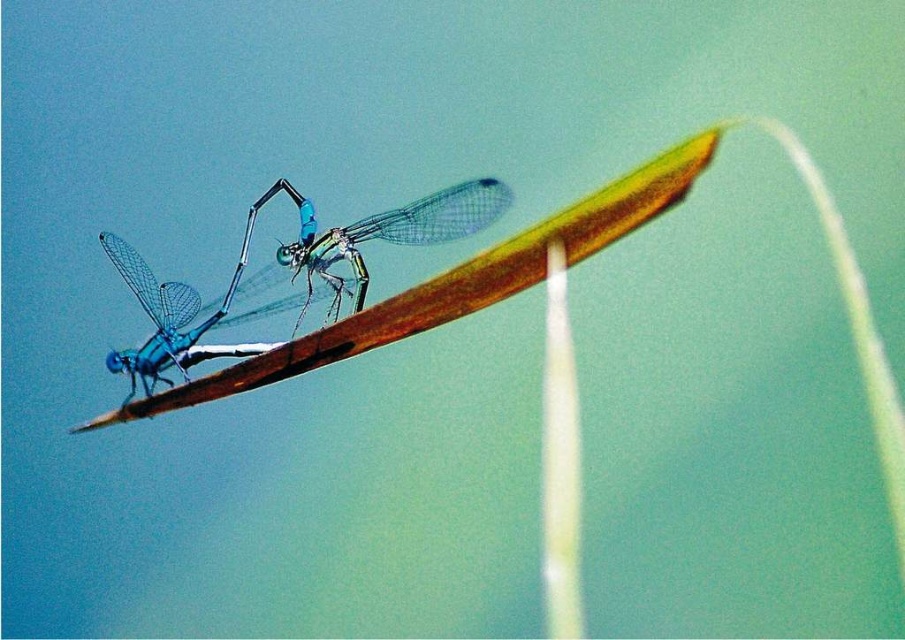
Question: Which object appears closest to the camera in this image?

Choices:
 (A) translucent glass dragonfly at center
 (B) translucent blue dragonfly at center

Answer: (B)

Question: Is translucent glass dragonfly at center closer to the viewer compared to translucent blue dragonfly at center?

Choices:
 (A) no
 (B) yes

Answer: (A)

Question: Which point is closer to the camera taking this photo?

Choices:
 (A) (334, 310)
 (B) (243, 342)

Answer: (B)

Question: Can you confirm if translucent glass dragonfly at center is positioned to the left of translucent blue dragonfly at center?

Choices:
 (A) yes
 (B) no

Answer: (B)

Question: Is translucent glass dragonfly at center above translucent blue dragonfly at center?

Choices:
 (A) no
 (B) yes

Answer: (B)